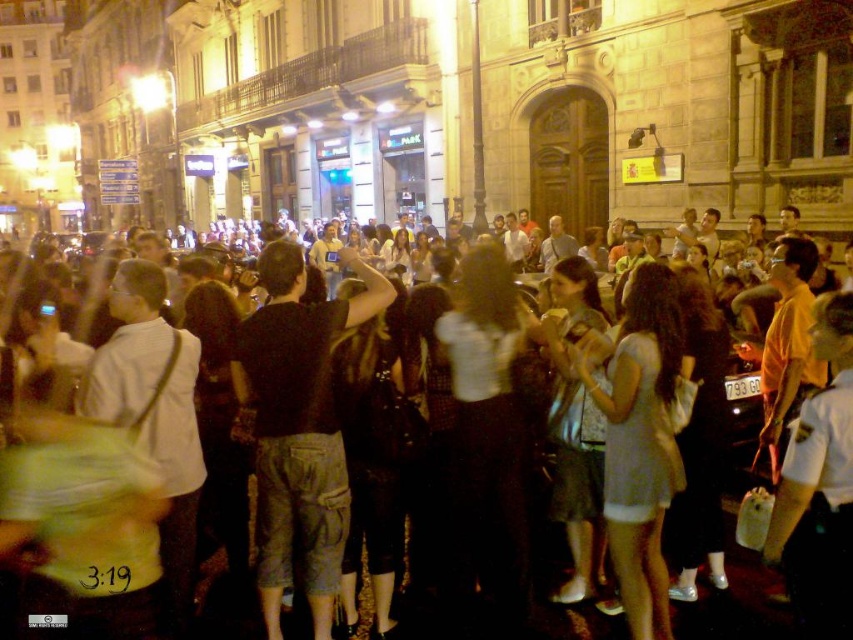
Based on the photo, you are a photographer trying to capture the lively atmosphere of the square. You notice a person wearing a black cotton shirt at center and a dark clothing crowd at center. Which one is narrower in width?

The black cotton shirt at center is narrower in width than the dark clothing crowd at center.

You are standing in the city square and want to take a photo of the black cotton shirt at center without anyone blocking the view. The camera you are using has a maximum zoom range of 20 meters. Can you capture the subject clearly without moving closer?

The distance between you and the black cotton shirt at center is 27.34 meters, which exceeds the camera maximum zoom range of 20 meters. Therefore, you cannot capture the subject clearly without moving closer.

You are standing in the city square and see the black cotton shirt at center and the dark clothing crowd at center. Which one is higher up?

The black cotton shirt at center is above the dark clothing crowd at center, so it is higher up.